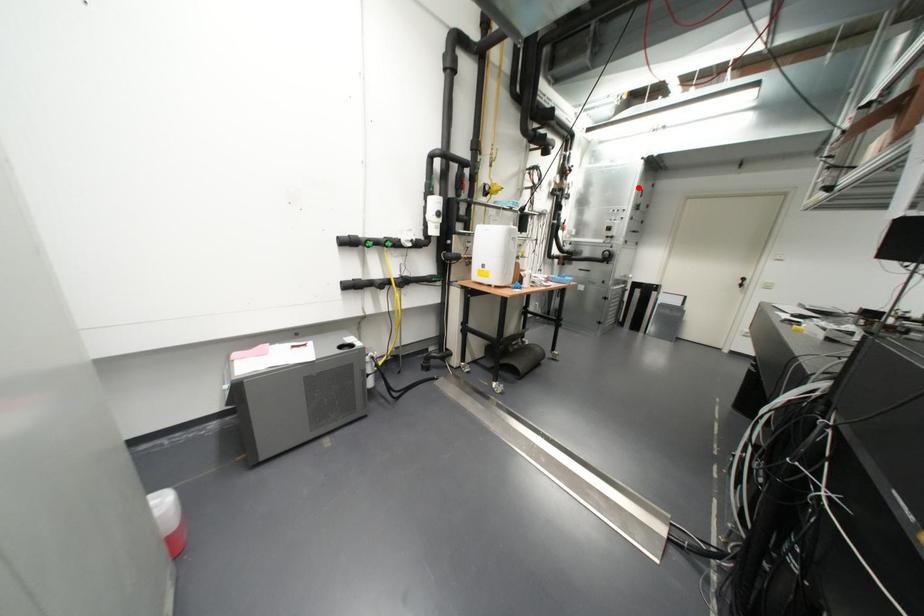
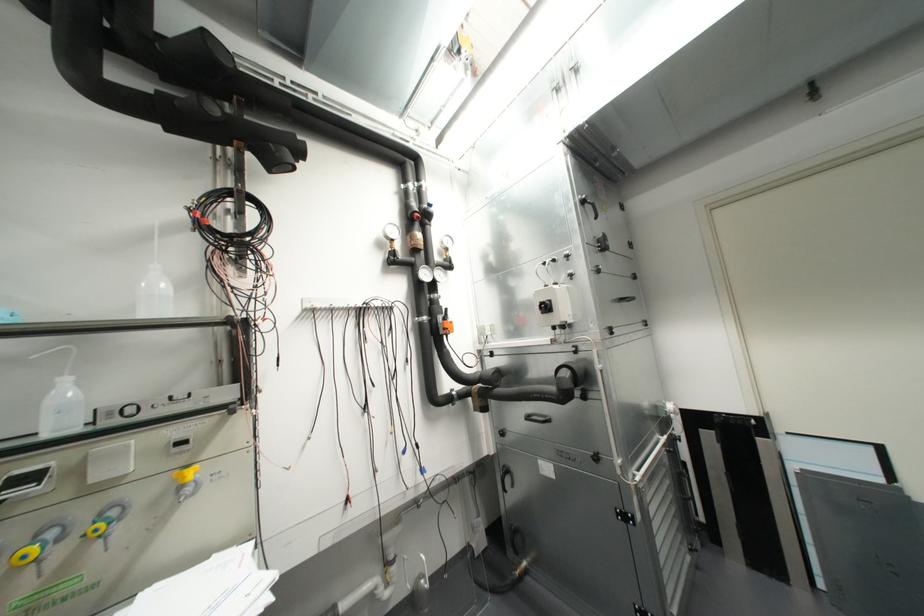
In the second image, find the point that corresponds to the highlighted location in the first image.

(582, 201)